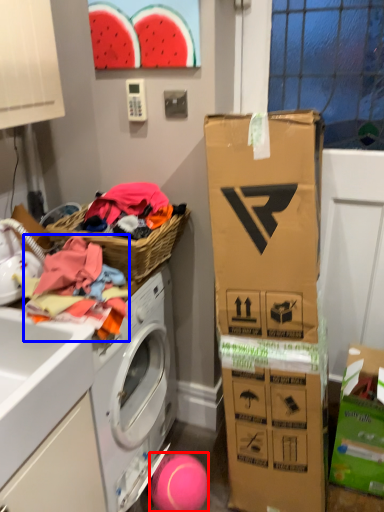
Question: Which object is further to the camera taking this photo, ball (highlighted by a red box) or clothing (highlighted by a blue box)?

Choices:
 (A) ball
 (B) clothing

Answer: (A)